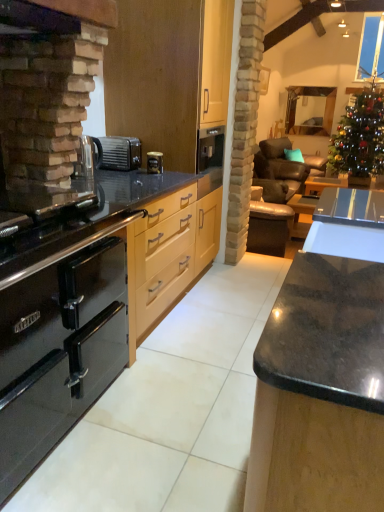
Measure the distance between point [370,144] and camera.

Point [370,144] and camera are 15.42 feet apart from each other.

In order to face green glittering christmas tree at upper right, should I rotate leftwards or rightwards?

To face it directly, rotate right by 21.564 degrees.

You are a GUI agent. You are given a task and a screenshot of the screen. Output one action in this format:
    pyautogui.click(x=<x>, y=<y>)
    Task: Click on the leather armchair at center
    This screenshot has height=512, width=384.
    Given the screenshot: What is the action you would take?
    pyautogui.click(x=269, y=222)

This screenshot has height=512, width=384. I want to click on black glossy table at center, so click(x=302, y=214).

In order to face black polished granite countertop at center, acting as the 3th cabinetry starting from the left, should I rotate leftwards or rightwards?

You should rotate right by 20.830 degrees.

This screenshot has height=512, width=384. I want to click on black polished granite countertop at center, which appears as the 1th cabinetry when viewed from the right, so click(324, 369).

Locate an element on the screen. The width and height of the screenshot is (384, 512). black glossy oven at left, which appears as the first cabinetry when viewed from the left is located at coordinates (58, 353).

Considering the positions of objects leather armchair at center and light wood cabinetry at center, marked as the 2th cabinetry in a left-to-right arrangement, in the image provided, who is more to the right, leather armchair at center or light wood cabinetry at center, marked as the 2th cabinetry in a left-to-right arrangement,?

leather armchair at center is more to the right.

From a real-world perspective, is leather armchair at center physically above light wood cabinetry at center, the second cabinetry from the right?

No, from a real-world perspective, leather armchair at center is not above light wood cabinetry at center, the second cabinetry from the right.

Which is closer to the camera, (258,184) or (182,164)?

Point (258,184) appears to be farther away from the viewer than point (182,164).

Between leather armchair at center and light wood cabinetry at center, the second cabinetry from the right, which one has larger size?

With larger size is light wood cabinetry at center, the second cabinetry from the right.

Between transparent glass window at upper right and green glittering christmas tree at upper right, which one is positioned behind?

transparent glass window at upper right is further away from the camera.

Is transparent glass window at upper right oriented towards green glittering christmas tree at upper right?

No.

Can you tell me how much transparent glass window at upper right and green glittering christmas tree at upper right differ in facing direction?

The angular difference between transparent glass window at upper right and green glittering christmas tree at upper right is 1.69 degrees.

Does black polished granite countertop at center, which appears as the 1th cabinetry when viewed from the right, lie behind metallic silver coffee machine at center?

No, the depth of black polished granite countertop at center, which appears as the 1th cabinetry when viewed from the right, is less than that of metallic silver coffee machine at center.

There is a metallic silver coffee machine at center. Where is `the 2nd cabinetry below it (from the image's perspective)`? the 2nd cabinetry below it (from the image's perspective) is located at coordinates (324, 369).

What's the angular difference between black polished granite countertop at center, acting as the 3th cabinetry starting from the left, and metallic silver coffee machine at center's facing directions?

0.0665 degrees separate the facing orientations of black polished granite countertop at center, acting as the 3th cabinetry starting from the left, and metallic silver coffee machine at center.

From a real-world perspective, relative to metallic silver coffee machine at center, is black polished granite countertop at center, which appears as the 1th cabinetry when viewed from the right, vertically above or below?

Clearly, from a real-world perspective, black polished granite countertop at center, which appears as the 1th cabinetry when viewed from the right, is below metallic silver coffee machine at center.

How many degrees apart are the facing directions of leather armchair at center and black glass countertop at left?

They differ by 15.5 degrees in their facing directions.

Looking at this image, can you confirm if leather armchair at center is positioned to the right of black glass countertop at left?

Correct, you'll find leather armchair at center to the right of black glass countertop at left.

Could you tell me if leather armchair at center is facing black glass countertop at left?

No, leather armchair at center is not aimed at black glass countertop at left.

Considering the relative sizes of leather armchair at center and black glass countertop at left in the image provided, is leather armchair at center taller than black glass countertop at left?

Indeed, leather armchair at center has a greater height compared to black glass countertop at left.

Where is `table located on the right of black glossy oven at left, the 3th cabinetry in the right-to-left sequence`? table located on the right of black glossy oven at left, the 3th cabinetry in the right-to-left sequence is located at coordinates (302, 214).

Considering the relative sizes of black glossy table at center and black glossy oven at left, the 3th cabinetry in the right-to-left sequence, in the image provided, is black glossy table at center taller than black glossy oven at left, the 3th cabinetry in the right-to-left sequence,?

No, black glossy table at center is not taller than black glossy oven at left, the 3th cabinetry in the right-to-left sequence.

Can black glossy oven at left, which appears as the first cabinetry when viewed from the left, be found inside black glossy table at center?

Definitely not — black glossy oven at left, which appears as the first cabinetry when viewed from the left, is not inside black glossy table at center.

Looking at this image, which object is positioned more to the right, black glossy table at center or black glossy oven at left, which appears as the first cabinetry when viewed from the left?

black glossy table at center is more to the right.

Which object is positioned more to the right, black glossy oven at left, which appears as the first cabinetry when viewed from the left, or black glossy table at center?

Positioned to the right is black glossy table at center.

From a real-world perspective, who is located lower, black glossy oven at left, the 3th cabinetry in the right-to-left sequence, or black glossy table at center?

black glossy table at center.

Considering the points (63, 340) and (312, 197), which point is behind, point (63, 340) or point (312, 197)?

The point (312, 197) is farther.

Is black glossy table at center completely or partially inside black glossy oven at left, the 3th cabinetry in the right-to-left sequence?

No.

From a real-world perspective, who is located lower, black glass countertop at left or black glossy table at center?

In real-world perspective, black glossy table at center is lower.

The width and height of the screenshot is (384, 512). Find the location of `countertop on the left of black glossy table at center`. countertop on the left of black glossy table at center is located at coordinates (93, 218).

From the image's perspective, is black glass countertop at left positioned above or below black glossy table at center?

Clearly, from the image's perspective, black glass countertop at left is below black glossy table at center.

Does black glass countertop at left turn towards black glossy table at center?

No, black glass countertop at left is not turned towards black glossy table at center.

Image resolution: width=384 pixels, height=512 pixels. I want to click on armchair located underneath the light wood cabinetry at center, the second cabinetry from the right (from a real-world perspective), so click(269, 222).

The width and height of the screenshot is (384, 512). What are the coordinates of `window screen above the green glittering christmas tree at upper right (from a real-world perspective)` in the screenshot? It's located at (371, 49).

Consider the image. Looking at the image, which one is located further to black glossy table at center, leather at right or light wood cabinetry at center, the second cabinetry from the right?

light wood cabinetry at center, the second cabinetry from the right, is further to black glossy table at center.

Which object lies nearer to the anchor point black polished granite countertop at center, acting as the 3th cabinetry starting from the left, leather at right or black glass countertop at left?

black glass countertop at left is positioned closer to the anchor black polished granite countertop at center, acting as the 3th cabinetry starting from the left.

When comparing their distances from black polished granite countertop at center, acting as the 3th cabinetry starting from the left, does transparent glass window at upper right or light wood cabinetry at center, marked as the 2th cabinetry in a left-to-right arrangement, seem further?

The object further to black polished granite countertop at center, acting as the 3th cabinetry starting from the left, is transparent glass window at upper right.

Looking at the image, which one is located further to black matte toaster at center, green glittering christmas tree at upper right or leather at right?

green glittering christmas tree at upper right lies further to black matte toaster at center than the other object.

Based on their spatial positions, is transparent glass window at upper right or black glossy oven at left, the 3th cabinetry in the right-to-left sequence, closer to green glittering christmas tree at upper right?

Among the two, transparent glass window at upper right is located nearer to green glittering christmas tree at upper right.

Looking at the image, which one is located closer to light wood cabinetry at center, marked as the 2th cabinetry in a left-to-right arrangement, black glass countertop at left or black glossy oven at left, which appears as the first cabinetry when viewed from the left?

Based on the image, black glass countertop at left appears to be nearer to light wood cabinetry at center, marked as the 2th cabinetry in a left-to-right arrangement.

From the image, which object appears to be nearer to leather armchair at center, black glossy oven at left, the 3th cabinetry in the right-to-left sequence, or black glass countertop at left?

black glass countertop at left is positioned closer to the anchor leather armchair at center.

Looking at the image, which one is located closer to black glossy table at center, metallic silver coffee machine at center or black glossy oven at left, which appears as the first cabinetry when viewed from the left?

metallic silver coffee machine at center is positioned closer to the anchor black glossy table at center.

At what (x,y) coordinates should I click in order to perform the action: click on appliance between black polished granite countertop at center, which appears as the 1th cabinetry when viewed from the right, and black glossy table at center in the front-back direction. Please return your answer as a coordinate pair (x, y). Looking at the image, I should click on (120, 153).

Where is `christmas tree between transparent glass window at upper right and black glossy table at center in the up-down direction`? christmas tree between transparent glass window at upper right and black glossy table at center in the up-down direction is located at coordinates (359, 139).

Locate an element on the screen. Image resolution: width=384 pixels, height=512 pixels. appliance located between black glass countertop at left and leather at right in the depth direction is located at coordinates (120, 153).

Locate an element on the screen. countertop between black polished granite countertop at center, which appears as the 1th cabinetry when viewed from the right, and transparent glass window at upper right in the front-back direction is located at coordinates (93, 218).